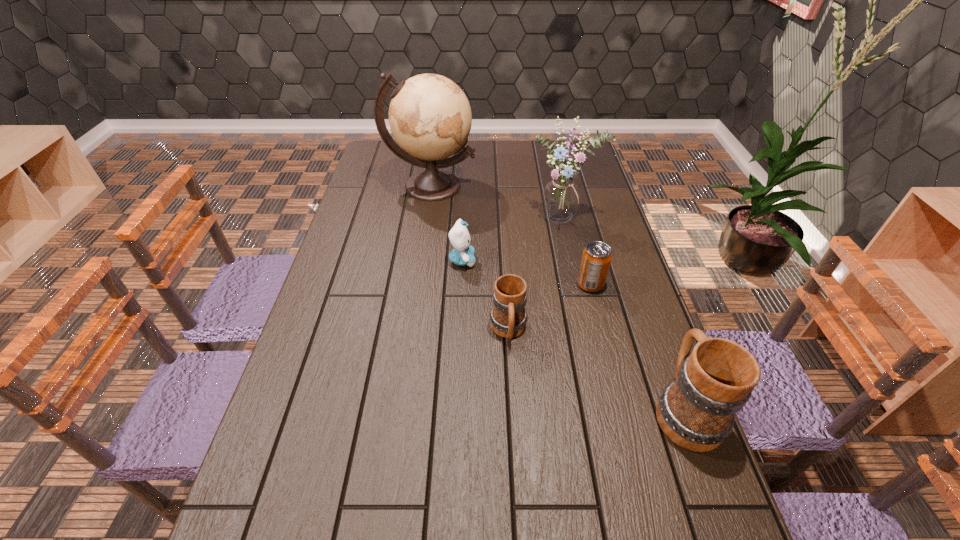
Please show where to add a mug on the left while keeping spacing even. Please provide its 2D coordinates. Your answer should be formatted as a tuple, i.e. [(x, y)], where the tuple contains the x and y coordinates of a point satisfying the conditions above.

[(376, 271)]